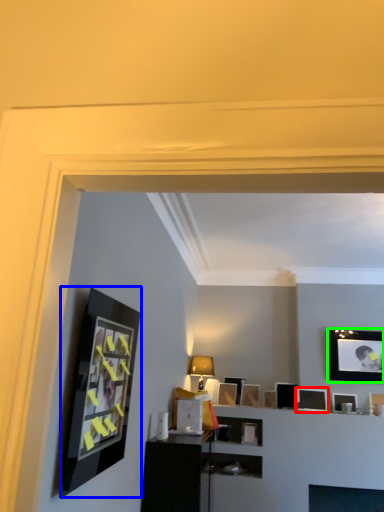
Question: Estimate the real-world distances between objects in this image. Which object is closer to picture frame (highlighted by a red box), picture frame (highlighted by a blue box) or picture frame (highlighted by a green box)?

Choices:
 (A) picture frame
 (B) picture frame

Answer: (B)